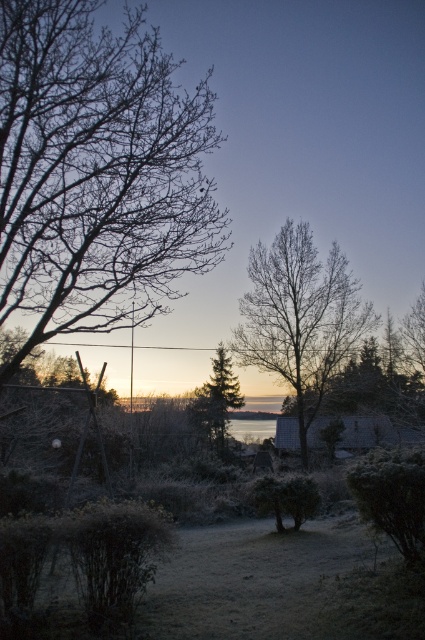
Can you confirm if bare branches at center is smaller than green textured pine tree at center?

No, bare branches at center is not smaller than green textured pine tree at center.

Which is behind, point (277, 371) or point (204, 404)?

The point (204, 404) is more distant.

Is point (357, 330) positioned after point (198, 392)?

That is False.

I want to click on bare branches at center, so click(300, 316).

Between bare branches at left and bare branches at center, which one is positioned lower?

bare branches at center is below.

Between bare branches at left and bare branches at center, which one has more height?

Standing taller between the two is bare branches at center.

The width and height of the screenshot is (425, 640). What do you see at coordinates (98, 172) in the screenshot? I see `bare branches at left` at bounding box center [98, 172].

Locate an element on the screen. bare branches at left is located at coordinates (98, 172).

In the scene shown: Who is positioned more to the right, bare branches at left or green textured pine tree at center?

From the viewer's perspective, green textured pine tree at center appears more on the right side.

Is bare branches at left to the left of green textured pine tree at center from the viewer's perspective?

Indeed, bare branches at left is positioned on the left side of green textured pine tree at center.

Does point (74, 6) come farther from viewer compared to point (232, 378)?

No, (74, 6) is closer to viewer.

Locate an element on the screen. This screenshot has height=640, width=425. bare branches at left is located at coordinates (98, 172).